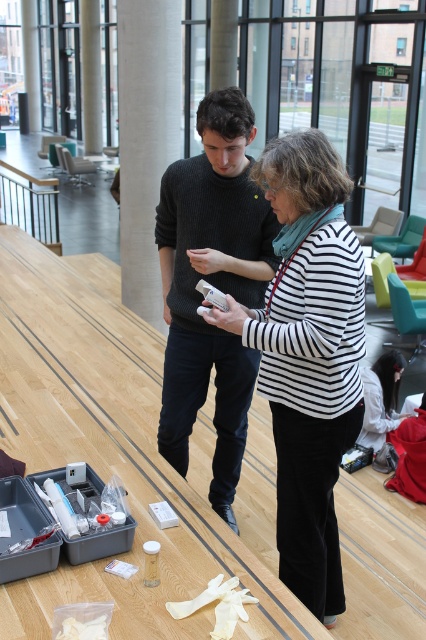
Who is lower down, knitted dark gray sweater at center or white plastic bag at lower left?

white plastic bag at lower left

Find the location of `knitted dark gray sweater at center`. knitted dark gray sweater at center is located at coordinates 213,284.

You are a GUI agent. You are given a task and a screenshot of the screen. Output one action in this format:
    pyautogui.click(x=<x>, y=<y>)
    Task: Click on the knitted dark gray sweater at center
    This screenshot has width=426, height=640.
    Given the screenshot: What is the action you would take?
    pyautogui.click(x=213, y=284)

Which of these two, wooden table at center or white fabric shirt at lower right, stands taller?

white fabric shirt at lower right is taller.

Is wooden table at center bigger than white fabric shirt at lower right?

Incorrect, wooden table at center is not larger than white fabric shirt at lower right.

Where is `wooden table at center`? This screenshot has width=426, height=640. wooden table at center is located at coordinates (112, 451).

Can you confirm if knitted dark gray sweater at center is thinner than white smooth pillar at center?

Yes, knitted dark gray sweater at center is thinner than white smooth pillar at center.

Does knitted dark gray sweater at center come in front of white smooth pillar at center?

Yes, knitted dark gray sweater at center is in front of white smooth pillar at center.

Identify the location of knitted dark gray sweater at center. Image resolution: width=426 pixels, height=640 pixels. (213, 284).